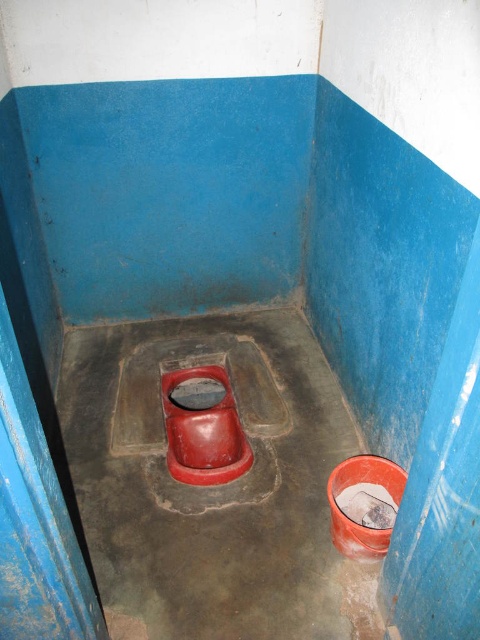
You are standing in the bathroom stall and want to place a new decorative item at the point with coordinates point (x=214, y=486). What object is located at that point?

The point (x=214, y=486) corresponds to the smooth plastic toilet at center, so placing a decorative item there would interfere with the toilet.

You are standing in the bathroom stall and need to place a new item exactly at the center of the stall. Where should you place it relative to the smooth plastic toilet at center?

The smooth plastic toilet at center is already located at the center of the stall, so placing the new item at the same location would mean placing it where the smooth plastic toilet at center is currently situated.